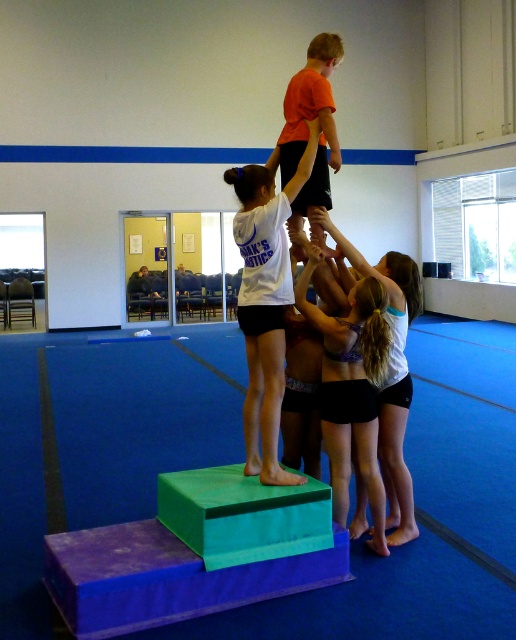
You are a gymnastics coach observing the scene. You notice the purple fabric shorts at center and the orange matte shirt at upper center. Which clothing item occupies more horizontal space in the image?

The purple fabric shorts at center occupies more horizontal space than the orange matte shirt at upper center because its width is larger.

You are a coach observing the gymnastics setup. You notice the white matte shirt at center and the orange matte shirt at upper center. Which shirt is closer to you?

The white matte shirt at center is closer to you because it is in front of the orange matte shirt at upper center.